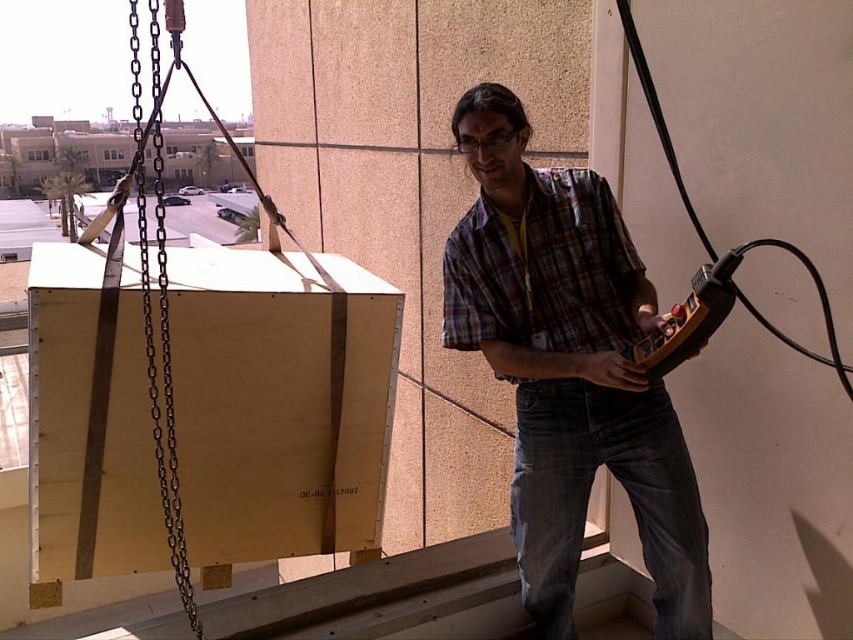
Who is positioned more to the left, plaid shirt at center or black metal chain at left?

black metal chain at left is more to the left.

Is plaid shirt at center positioned at the back of black metal chain at left?

Yes, it is.

Identify the location of plaid shirt at center. Image resolution: width=853 pixels, height=640 pixels. (569, 369).